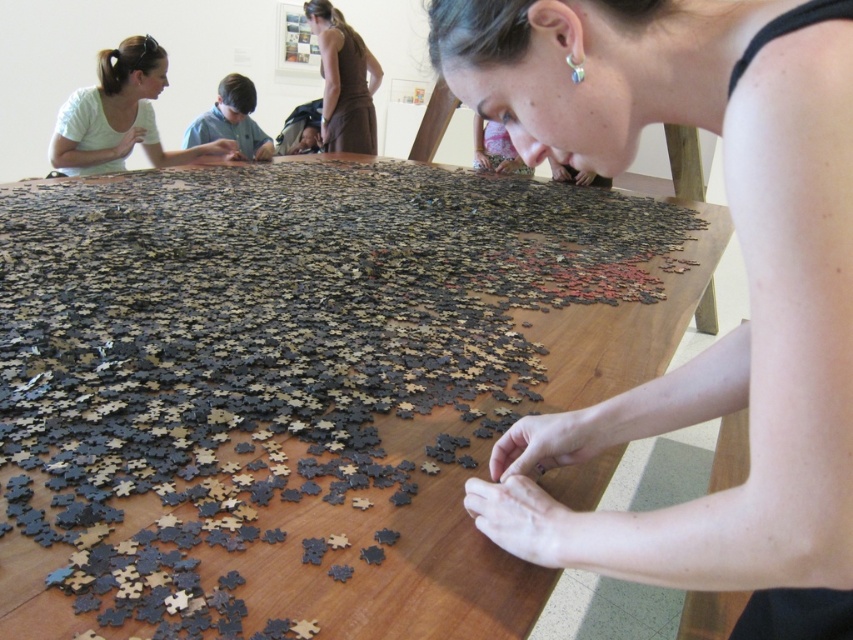
Question: Does wooden puzzle pieces at center appear under matte black puzzle pieces at center?

Choices:
 (A) no
 (B) yes

Answer: (A)

Question: Which of these objects is positioned closest to the matte black puzzle pieces at center?

Choices:
 (A) brown fabric dress at upper center
 (B) wooden puzzle pieces at center

Answer: (B)

Question: Which point appears closest to the camera in this image?

Choices:
 (A) (317, 8)
 (B) (221, 92)
 (C) (538, 444)

Answer: (C)

Question: Considering the relative positions of wooden puzzle pieces at center and matte black puzzle pieces at center in the image provided, where is wooden puzzle pieces at center located with respect to matte black puzzle pieces at center?

Choices:
 (A) right
 (B) left

Answer: (B)

Question: Based on their relative distances, which object is nearer to the matte black puzzle pieces at center?

Choices:
 (A) blue shirt at center
 (B) brown fabric dress at upper center

Answer: (A)

Question: Does wooden puzzle pieces at center have a greater width compared to matte black puzzle pieces at center?

Choices:
 (A) yes
 (B) no

Answer: (A)